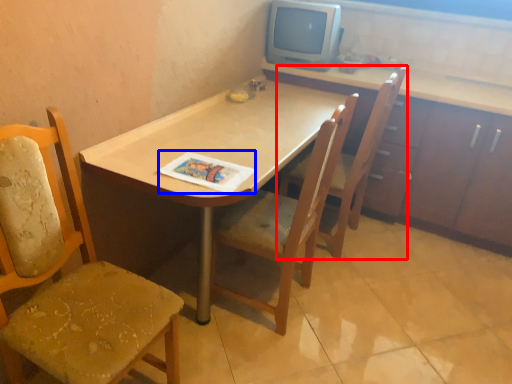
Question: Which point is further to the camera, chair (highlighted by a red box) or magazine (highlighted by a blue box)?

Choices:
 (A) chair
 (B) magazine

Answer: (A)